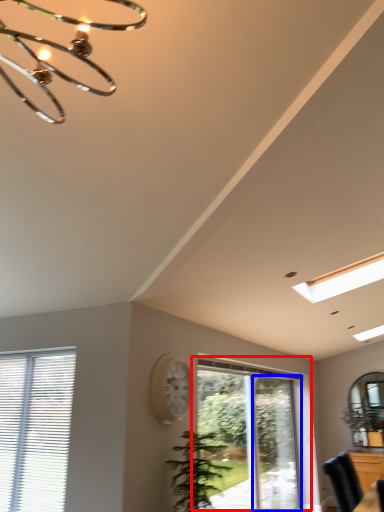
Question: Which of the following is the farthest to the observer, window (highlighted by a red box) or screen door (highlighted by a blue box)?

Choices:
 (A) window
 (B) screen door

Answer: (B)